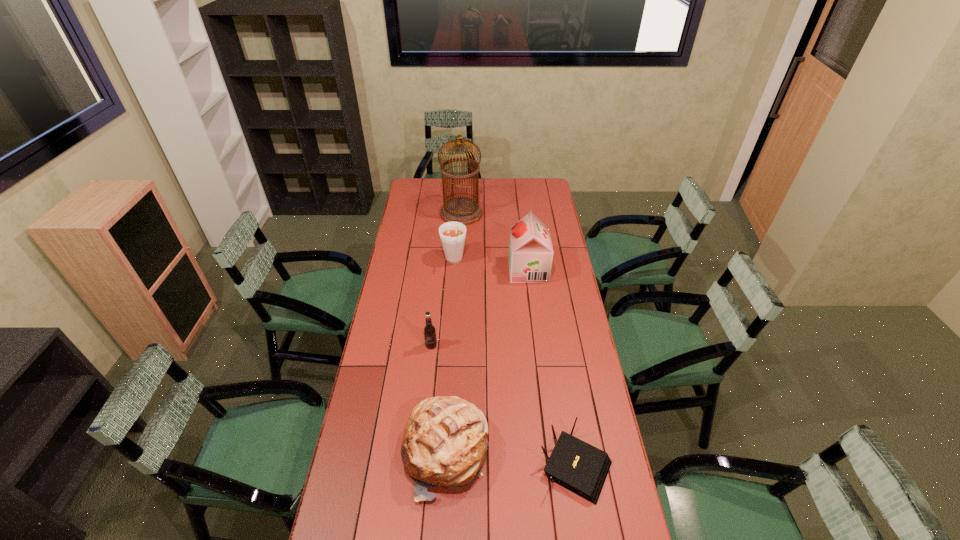
The width and height of the screenshot is (960, 540). What are the coordinates of `vacant space at the right edge of the desktop` in the screenshot? It's located at (557, 347).

In the image, there is a desktop. Where is `free space at the far left corner`? The height and width of the screenshot is (540, 960). free space at the far left corner is located at coordinates (408, 193).

I want to click on free space between the router and the bread, so click(x=511, y=459).

Identify the location of empty space that is in between the taller root beer and the shorter root beer. This screenshot has width=960, height=540. (443, 303).

Where is `vacant area that lies between the router and the farther root beer`? The height and width of the screenshot is (540, 960). vacant area that lies between the router and the farther root beer is located at coordinates (515, 363).

The height and width of the screenshot is (540, 960). I want to click on free point between the shortest object and the second tallest object, so click(552, 368).

I want to click on free space between the birdcage and the shortest object, so click(518, 339).

The width and height of the screenshot is (960, 540). In order to click on vacant space in between the fourth shortest object and the bread in this screenshot , I will do `click(450, 357)`.

Locate an element on the screen. This screenshot has width=960, height=540. empty location between the shortest object and the nearer root beer is located at coordinates (503, 405).

The width and height of the screenshot is (960, 540). I want to click on vacant point located between the tallest object and the soya milk, so click(494, 242).